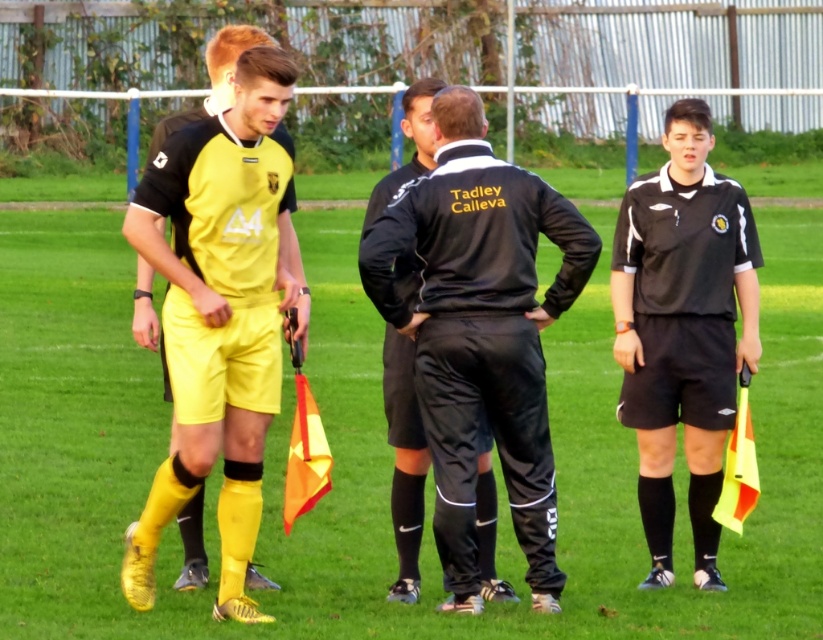
Does black matte jacket at center lie in front of yellow matte shorts at left?

No, it is behind yellow matte shorts at left.

Is point (468, 195) closer to camera compared to point (261, 326)?

That is True.

Who is more forward, (439, 410) or (243, 420)?

Point (439, 410) is more forward.

This screenshot has height=640, width=823. Identify the location of black matte jacket at center. (481, 333).

Between black matte referee uniform at right and matte yellow shorts at left, which one has more height?

black matte referee uniform at right is taller.

I want to click on black matte referee uniform at right, so click(x=682, y=330).

You are a GUI agent. You are given a task and a screenshot of the screen. Output one action in this format:
    pyautogui.click(x=<x>, y=<y>)
    Task: Click on the black matte referee uniform at right
    The height and width of the screenshot is (640, 823).
    Given the screenshot: What is the action you would take?
    pyautogui.click(x=682, y=330)

Is yellow matte shorts at left to the right of black matte referee uniform at right from the viewer's perspective?

Incorrect, yellow matte shorts at left is not on the right side of black matte referee uniform at right.

Which is in front, point (236, 288) or point (639, 440)?

Positioned in front is point (236, 288).

Where is `yellow matte shorts at left`? yellow matte shorts at left is located at coordinates (219, 312).